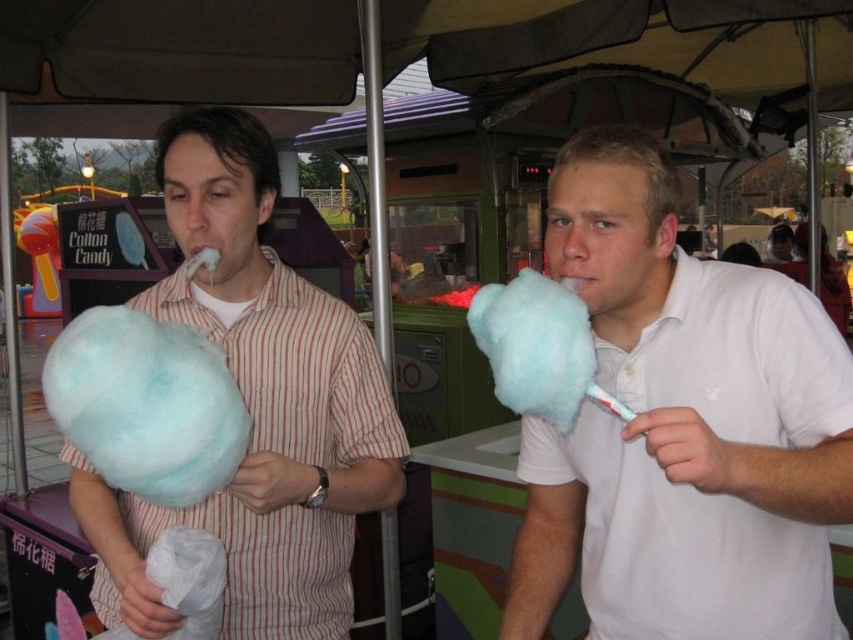
Does matte cotton candy at left come behind light blue fluffy cotton candy at left?

Yes, matte cotton candy at left is further from the viewer.

Between matte cotton candy at left and light blue fluffy cotton candy at left, which one is positioned lower?

Positioned lower is light blue fluffy cotton candy at left.

Is point (270, 637) behind point (175, 488)?

Yes, point (270, 637) is behind point (175, 488).

Find the location of a particular element. The width and height of the screenshot is (853, 640). matte cotton candy at left is located at coordinates (254, 406).

Is white cotton candy at center positioned before light blue fluffy cotton candy at left?

That is True.

Who is taller, white cotton candy at center or light blue fluffy cotton candy at left?

With more height is white cotton candy at center.

At what (x,y) coordinates should I click in order to perform the action: click on white cotton candy at center. Please return your answer as a coordinate pair (x, y). Image resolution: width=853 pixels, height=640 pixels. Looking at the image, I should click on (682, 428).

Locate an element on the screen. white cotton candy at center is located at coordinates (682, 428).

Is white cotton candy at center taller than matte cotton candy at left?

Result: Incorrect, white cotton candy at center's height is not larger of matte cotton candy at left's.

Who is higher up, white cotton candy at center or matte cotton candy at left?

Positioned higher is matte cotton candy at left.

Is point (697, 330) in front of point (328, 470)?

Yes, it is.

Locate an element on the screen. Image resolution: width=853 pixels, height=640 pixels. white cotton candy at center is located at coordinates (682, 428).